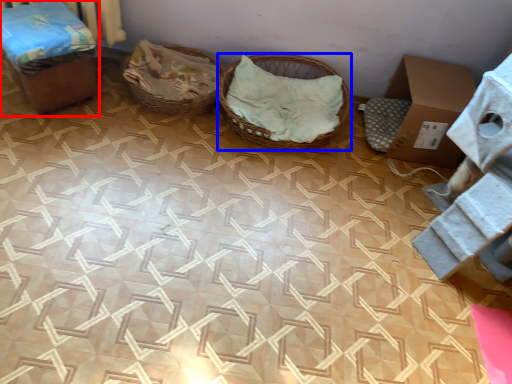
Question: Which point is further to the camera, furniture (highlighted by a red box) or basket (highlighted by a blue box)?

Choices:
 (A) furniture
 (B) basket

Answer: (B)